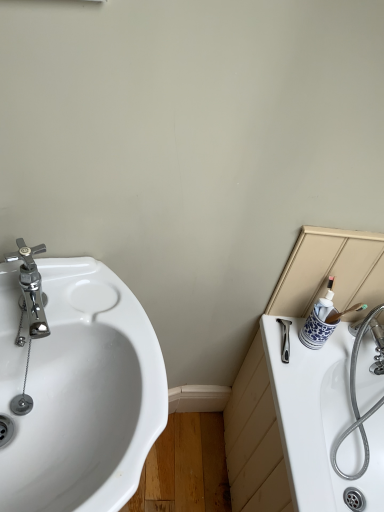
Question: In terms of height, does white glossy sink at left look taller or shorter compared to chrome/metallic faucet at left?

Choices:
 (A) short
 (B) tall

Answer: (B)

Question: Would you say white glossy sink at left is to the left or to the right of chrome/metallic faucet at left in the picture?

Choices:
 (A) right
 (B) left

Answer: (A)

Question: Estimate the real-world distances between objects in this image. Which object is farther from the white glossy sink at left?

Choices:
 (A) blue and white ceramic cup at right
 (B) chrome/metallic faucet at left
 (C) white ceramic bath at right

Answer: (A)

Question: Which object is the closest to the blue and white ceramic cup at right?

Choices:
 (A) white glossy sink at left
 (B) chrome/metallic faucet at left
 (C) white ceramic bath at right

Answer: (C)